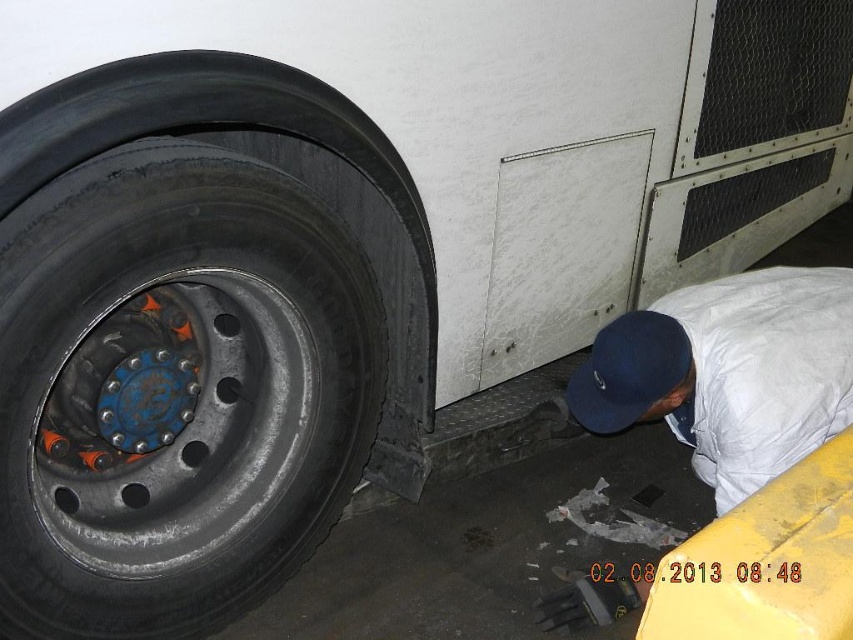
Does white fabric at lower right have a lesser height compared to blue fabric baseball cap at lower right?

No.

This screenshot has width=853, height=640. I want to click on white fabric at lower right, so click(730, 371).

Can you confirm if blue metallic rim at lower left is positioned to the right of white fabric at lower right?

In fact, blue metallic rim at lower left is to the left of white fabric at lower right.

Between blue metallic rim at lower left and white fabric at lower right, which one is positioned higher?

Positioned higher is blue metallic rim at lower left.

You are a GUI agent. You are given a task and a screenshot of the screen. Output one action in this format:
    pyautogui.click(x=<x>, y=<y>)
    Task: Click on the blue metallic rim at lower left
    
    Given the screenshot: What is the action you would take?
    pyautogui.click(x=173, y=390)

Between blue metallic rim at lower left and blue fabric baseball cap at lower right, which one has less height?

With less height is blue fabric baseball cap at lower right.

Can you confirm if blue metallic rim at lower left is positioned above blue fabric baseball cap at lower right?

No, blue metallic rim at lower left is not above blue fabric baseball cap at lower right.

Who is more distant from viewer, (102, 365) or (607, 376)?

Point (607, 376)

You are a GUI agent. You are given a task and a screenshot of the screen. Output one action in this format:
    pyautogui.click(x=<x>, y=<y>)
    Task: Click on the blue metallic rim at lower left
    The width and height of the screenshot is (853, 640).
    Given the screenshot: What is the action you would take?
    pyautogui.click(x=173, y=390)